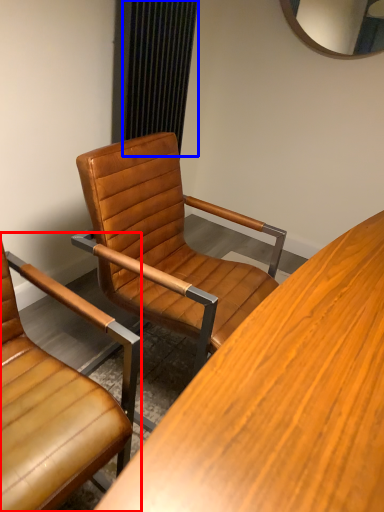
Question: Among these objects, which one is farthest to the camera, chair (highlighted by a red box) or curtain (highlighted by a blue box)?

Choices:
 (A) chair
 (B) curtain

Answer: (B)